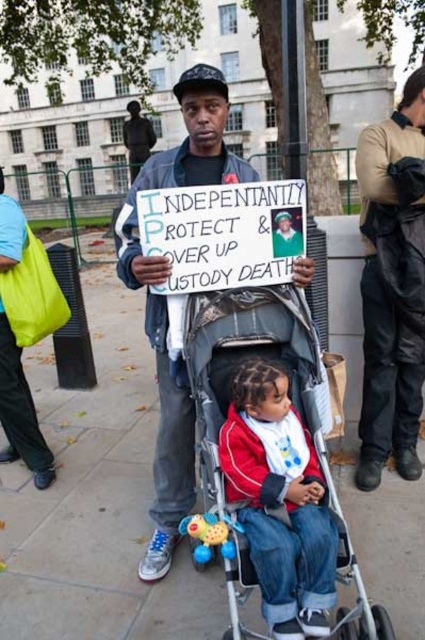
You are standing in the public space near the classical building and see two points marked in the image. Which point is closer to you, point [300,474] or point [14,420]?

Point [300,474] is closer to the viewer than point [14,420].

You are a photographer trying to capture a clear shot of the gray concrete pavement at center and the red fleece jacket at center. Based on their sizes in the image, which object would you need to move closer to the camera to ensure both appear equally large in your photo?

The gray concrete pavement at center is smaller than the red fleece jacket at center. To make them appear equally large, you should move the gray concrete pavement at center closer to the camera since it is currently smaller.